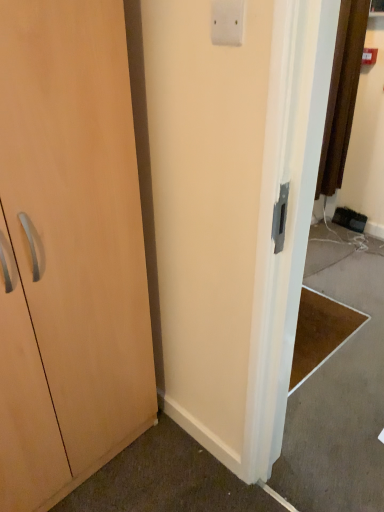
Question: Is white plastic light switch at upper center thinner than light wood cabinet at left?

Choices:
 (A) yes
 (B) no

Answer: (A)

Question: Is white plastic light switch at upper center smaller than light wood cabinet at left?

Choices:
 (A) yes
 (B) no

Answer: (A)

Question: Is white plastic light switch at upper center facing towards light wood cabinet at left?

Choices:
 (A) no
 (B) yes

Answer: (A)

Question: Is white plastic light switch at upper center not inside light wood cabinet at left?

Choices:
 (A) no
 (B) yes

Answer: (B)

Question: Is white plastic light switch at upper center touching light wood cabinet at left?

Choices:
 (A) yes
 (B) no

Answer: (B)

Question: Can you confirm if white plastic light switch at upper center is positioned to the right of light wood cabinet at left?

Choices:
 (A) yes
 (B) no

Answer: (A)

Question: Can you confirm if light wood cabinet at left is shorter than white plastic light switch at upper center?

Choices:
 (A) yes
 (B) no

Answer: (B)

Question: Is light wood cabinet at left positioned with its back to white plastic light switch at upper center?

Choices:
 (A) no
 (B) yes

Answer: (A)

Question: From a real-world perspective, is light wood cabinet at left located beneath white plastic light switch at upper center?

Choices:
 (A) no
 (B) yes

Answer: (B)

Question: From the image's perspective, is light wood cabinet at left below white plastic light switch at upper center?

Choices:
 (A) yes
 (B) no

Answer: (A)

Question: Is light wood cabinet at left thinner than white plastic light switch at upper center?

Choices:
 (A) yes
 (B) no

Answer: (B)

Question: Considering the relative positions of light wood cabinet at left and white plastic light switch at upper center in the image provided, is light wood cabinet at left to the right of white plastic light switch at upper center from the viewer's perspective?

Choices:
 (A) no
 (B) yes

Answer: (A)

Question: Which is correct: light wood cabinet at left is inside white plastic light switch at upper center, or outside of it?

Choices:
 (A) inside
 (B) outside

Answer: (B)